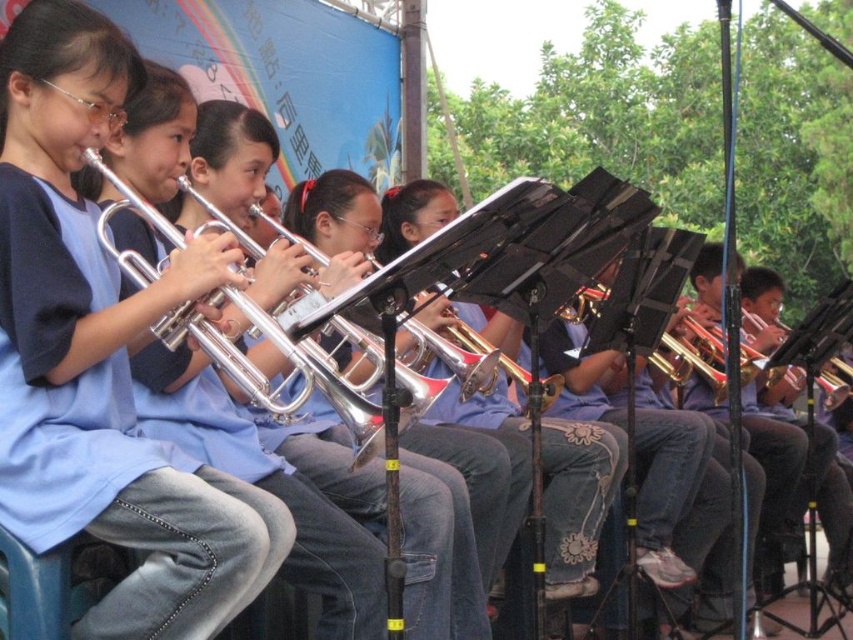
Does point (166, 230) lie in front of point (451, 330)?

Yes, point (166, 230) is closer to viewer.

Is point (120, 198) positioned in front of point (476, 332)?

Yes, point (120, 198) is in front of point (476, 332).

Where is `silver shiny trumpet at center`? Image resolution: width=853 pixels, height=640 pixels. silver shiny trumpet at center is located at coordinates (236, 349).

What do you see at coordinates (334, 518) in the screenshot?
I see `matte silver trumpet at center` at bounding box center [334, 518].

Does matte silver trumpet at center come behind brushed metal trumpet at center?

No, it is in front of brushed metal trumpet at center.

Locate an element on the screen. The height and width of the screenshot is (640, 853). matte silver trumpet at center is located at coordinates (334, 518).

Does matte silver trumpet at center appear on the left side of silver shiny trumpet at center?

No, matte silver trumpet at center is not to the left of silver shiny trumpet at center.

Is point (201, 360) farther from camera compared to point (103, 211)?

Yes, it is behind point (103, 211).

Which is behind, point (430, 480) or point (230, 346)?

Positioned behind is point (430, 480).

You are a GUI agent. You are given a task and a screenshot of the screen. Output one action in this format:
    pyautogui.click(x=<x>, y=<y>)
    Task: Click on the matte silver trumpet at center
    This screenshot has width=853, height=640.
    Given the screenshot: What is the action you would take?
    pyautogui.click(x=334, y=518)